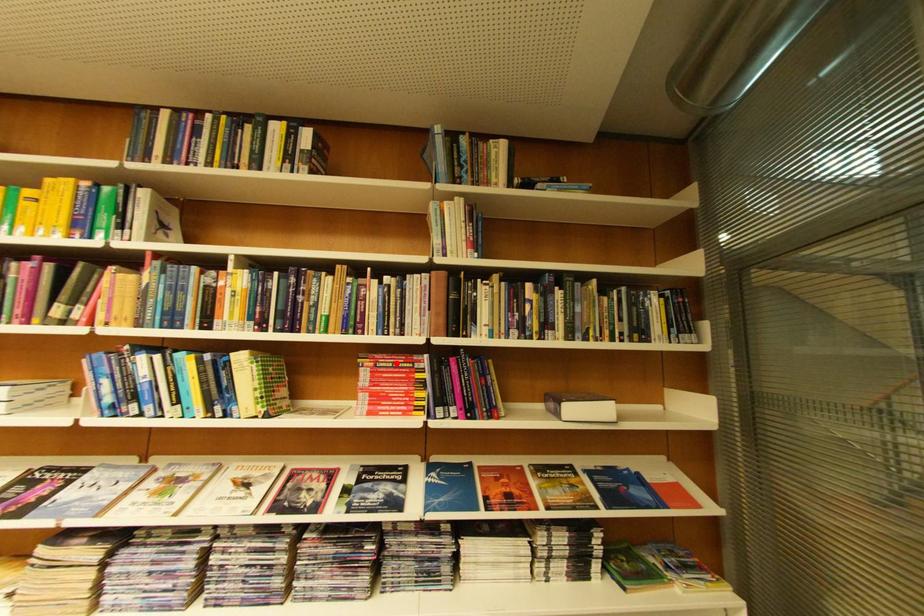
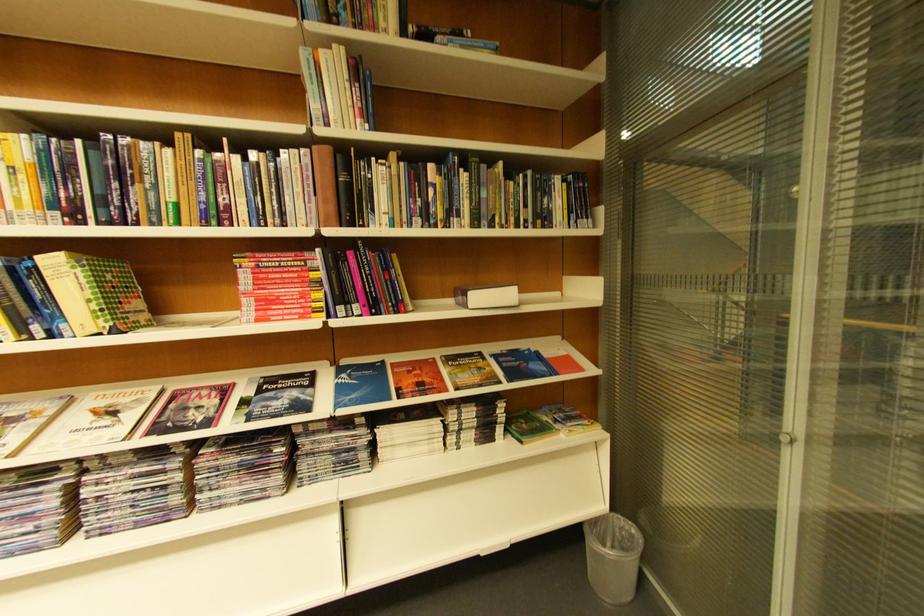
In the second image, find the point that corresponds to the highlighted location in the first image.

(281, 262)